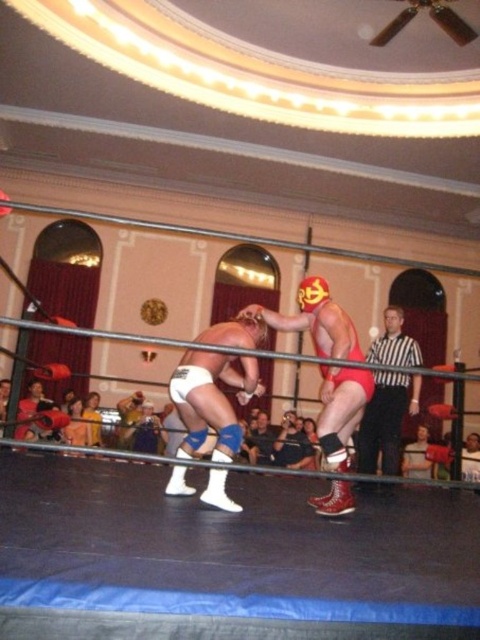
Can you confirm if red matte wrestling mask at center is positioned below black-and-white striped shirt at right?

No.

Does red matte wrestling mask at center appear on the right side of black-and-white striped shirt at right?

No, red matte wrestling mask at center is not to the right of black-and-white striped shirt at right.

Is point (347, 316) less distant than point (383, 433)?

Yes, it is.

Find the location of `red matte wrestling mask at center`. red matte wrestling mask at center is located at coordinates tap(314, 321).

This screenshot has height=640, width=480. What do you see at coordinates (211, 401) in the screenshot? I see `white matte shorts at center` at bounding box center [211, 401].

Does white matte shorts at center appear on the right side of red matte wrestling mask at center?

No, white matte shorts at center is not to the right of red matte wrestling mask at center.

Is point (192, 406) farther from camera compared to point (324, 506)?

Yes, it is.

What are the coordinates of `white matte shorts at center` in the screenshot? It's located at (211, 401).

Does white matte shorts at center appear on the right side of black-and-white striped shirt at right?

In fact, white matte shorts at center is to the left of black-and-white striped shirt at right.

Is white matte shorts at center taller than black-and-white striped shirt at right?

In fact, white matte shorts at center may be shorter than black-and-white striped shirt at right.

What do you see at coordinates (211, 401) in the screenshot?
I see `white matte shorts at center` at bounding box center [211, 401].

Find the location of a particular element. white matte shorts at center is located at coordinates (211, 401).